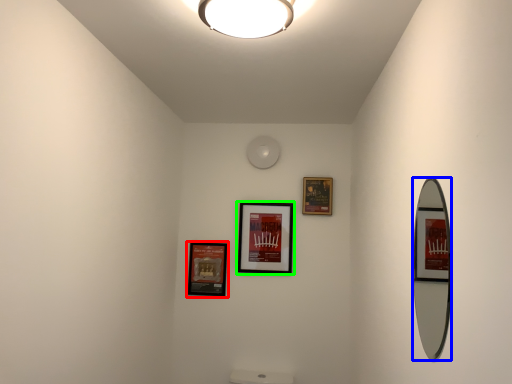
Question: Which object is positioned farthest from picture frame (highlighted by a red box)? Select from mirror (highlighted by a blue box) and picture frame (highlighted by a green box).

Choices:
 (A) mirror
 (B) picture frame

Answer: (A)